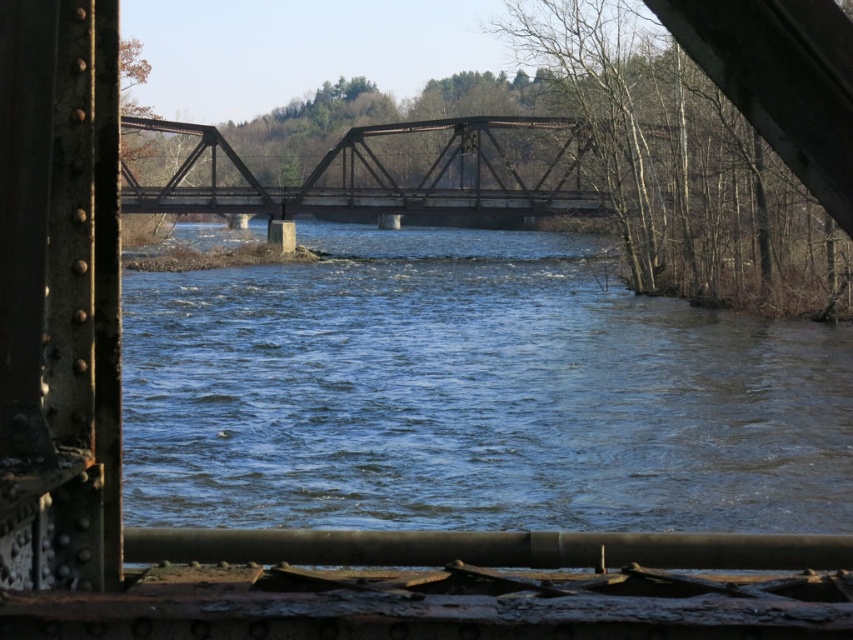
You are an engineer inspecting the structure. You notice the blue water at center and the rusty metal bridge at center. Which one has a bigger area in the image?

The blue water at center is larger in size than the rusty metal bridge at center, so the blue water at center has a bigger area in the image.

You are standing inside a structure looking out towards a river and another bridge. You notice a specific point marked at coordinates point (x=612, y=333). Based on the scene, can you estimate how far this point is from your current position?

The point (x=612, y=333) is 142.88 feet away from the viewer.

You are a photographer planning to capture the entire view of the blue water at center and the rusty metal bridge at center in one shot. Based on the scene description, which object would require you to adjust your camera angle to ensure both are fully visible in the frame?

The blue water at center has a greater width than the rusty metal bridge at center, so you would need to adjust your camera angle to accommodate the wider blue water at center to ensure both are fully visible in the frame.